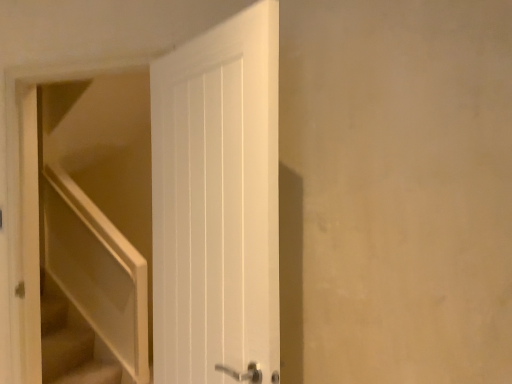
The image size is (512, 384). What are the coordinates of `white matte door at left` in the screenshot? It's located at (87, 224).

The width and height of the screenshot is (512, 384). What do you see at coordinates (87, 224) in the screenshot? I see `white matte door at left` at bounding box center [87, 224].

What is the approximate height of beige carpeted stairs at lower left?

beige carpeted stairs at lower left is 22.65 centimeters tall.

The image size is (512, 384). In order to click on beige carpeted stairs at lower left in this screenshot , I will do `click(91, 374)`.

Describe the element at coordinates (91, 374) in the screenshot. I see `beige carpeted stairs at lower left` at that location.

Image resolution: width=512 pixels, height=384 pixels. What are the coordinates of `white matte door at left` in the screenshot? It's located at (87, 224).

Is white matte door at left to the left of beige carpeted stairs at lower left from the viewer's perspective?

No, white matte door at left is not to the left of beige carpeted stairs at lower left.

In the image, is white matte door at left positioned in front of or behind beige carpeted stairs at lower left?

white matte door at left is positioned closer to the viewer than beige carpeted stairs at lower left.

Considering the points (77, 174) and (85, 376), which point is behind, point (77, 174) or point (85, 376)?

Point (77, 174)

From the image's perspective, is white matte door at left above or below beige carpeted stairs at lower left?

white matte door at left is situated higher than beige carpeted stairs at lower left in the image.

From a real-world perspective, between white matte door at left and beige carpeted stairs at lower left, who is vertically lower?

beige carpeted stairs at lower left, from a real-world perspective.

Can you confirm if white matte door at left is wider than beige carpeted stairs at lower left?

Incorrect, the width of white matte door at left does not surpass that of beige carpeted stairs at lower left.

In the scene shown: Considering the sizes of objects white matte door at left and beige carpeted stairs at lower left in the image provided, who is taller, white matte door at left or beige carpeted stairs at lower left?

Standing taller between the two is white matte door at left.

Based on their sizes in the image, would you say white matte door at left is bigger or smaller than beige carpeted stairs at lower left?

Clearly, white matte door at left is larger in size than beige carpeted stairs at lower left.

Is white matte door at left inside or outside of beige carpeted stairs at lower left?

white matte door at left lies outside beige carpeted stairs at lower left.

Are white matte door at left and beige carpeted stairs at lower left making contact?

No, white matte door at left is not in contact with beige carpeted stairs at lower left.

Is white matte door at left facing away from beige carpeted stairs at lower left?

white matte door at left is not turned away from beige carpeted stairs at lower left.

Can you tell me how much white matte door at left and beige carpeted stairs at lower left differ in facing direction?

The facing directions of white matte door at left and beige carpeted stairs at lower left are 88.2 degrees apart.

Where is `elevator above the beige carpeted stairs at lower left (from the image's perspective)`? The width and height of the screenshot is (512, 384). elevator above the beige carpeted stairs at lower left (from the image's perspective) is located at coordinates (87, 224).

Based on their positions, is beige carpeted stairs at lower left located to the left or right of white matte door at left?

Based on their positions, beige carpeted stairs at lower left is located to the left of white matte door at left.

Which object is further away from the camera, beige carpeted stairs at lower left or white matte door at left?

beige carpeted stairs at lower left is further from the camera.

Between point (53, 380) and point (58, 207), which one is positioned behind?

The point (58, 207) is more distant.

From the image's perspective, which is below, beige carpeted stairs at lower left or white matte door at left?

beige carpeted stairs at lower left is shown below in the image.

From a real-world perspective, which is physically below, beige carpeted stairs at lower left or white matte door at left?

beige carpeted stairs at lower left.

Between beige carpeted stairs at lower left and white matte door at left, which one has smaller width?

white matte door at left is thinner.

Considering the relative sizes of beige carpeted stairs at lower left and white matte door at left in the image provided, is beige carpeted stairs at lower left taller than white matte door at left?

No.

Who is smaller, beige carpeted stairs at lower left or white matte door at left?

beige carpeted stairs at lower left is smaller.

Is beige carpeted stairs at lower left not inside white matte door at left?

That's correct, beige carpeted stairs at lower left is outside of white matte door at left.

Is beige carpeted stairs at lower left not close to white matte door at left?

beige carpeted stairs at lower left is positioned a significant distance from white matte door at left.

Could you tell me if beige carpeted stairs at lower left is facing white matte door at left?

No, beige carpeted stairs at lower left is not facing towards white matte door at left.

How different are the orientations of beige carpeted stairs at lower left and white matte door at left in degrees?

The angle between the facing direction of beige carpeted stairs at lower left and the facing direction of white matte door at left is 88.2 degrees.

This screenshot has width=512, height=384. Identify the location of stairs below the white matte door at left (from a real-world perspective). (91, 374).

Where is `stairs on the left side of white matte door at left`? The height and width of the screenshot is (384, 512). stairs on the left side of white matte door at left is located at coordinates (91, 374).

This screenshot has height=384, width=512. What are the coordinates of `elevator lying on the right of beige carpeted stairs at lower left` in the screenshot? It's located at (87, 224).